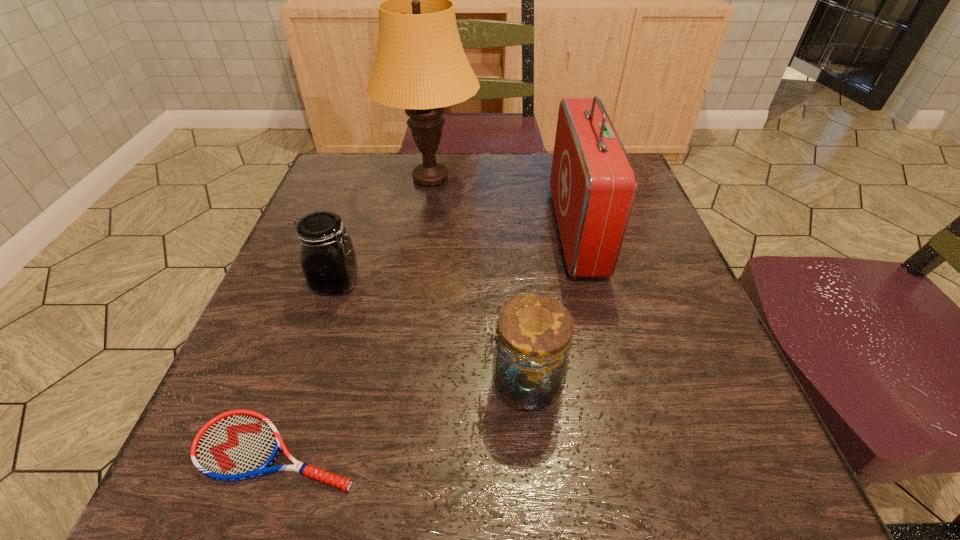
Identify the location of lampshade. The width and height of the screenshot is (960, 540). (420, 65).

Image resolution: width=960 pixels, height=540 pixels. Find the location of `the fourth shortest object`. the fourth shortest object is located at coordinates tap(593, 183).

The height and width of the screenshot is (540, 960). I want to click on the first-aid kit, so click(x=593, y=183).

Where is `the right jar`? The width and height of the screenshot is (960, 540). the right jar is located at coordinates (533, 338).

In order to click on the nearer jar in this screenshot , I will do `click(533, 338)`.

At what (x,y) coordinates should I click in order to perform the action: click on the farther jar. Please return your answer as a coordinate pair (x, y). Image resolution: width=960 pixels, height=540 pixels. Looking at the image, I should click on (327, 256).

This screenshot has width=960, height=540. What are the coordinates of `the shortest object` in the screenshot? It's located at (236, 445).

Locate an element on the screen. free space located on the right of the tallest object is located at coordinates (564, 178).

Locate an element on the screen. The image size is (960, 540). free space located 0.070m on the side of the rightmost object with the first aid cross symbol is located at coordinates (524, 231).

You are a GUI agent. You are given a task and a screenshot of the screen. Output one action in this format:
    pyautogui.click(x=<x>, y=<y>)
    Task: Click on the vacant region located on the side of the rightmost object with the first aid cross symbol
    This screenshot has width=960, height=540.
    Given the screenshot: What is the action you would take?
    pyautogui.click(x=403, y=231)